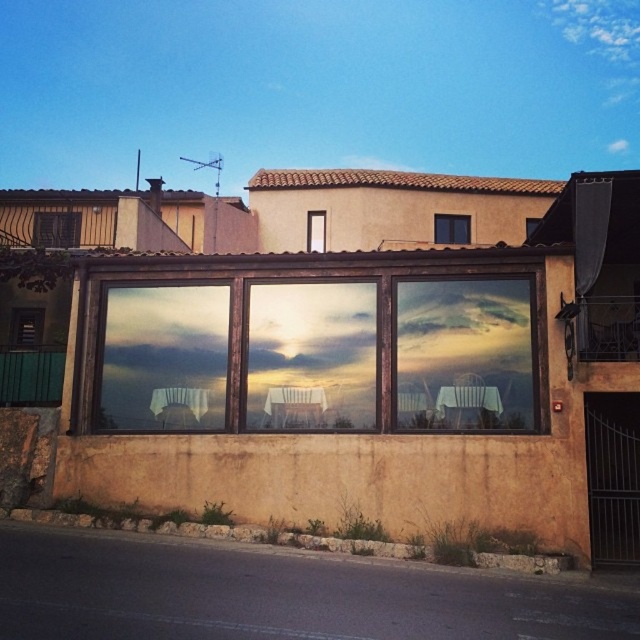
Can you confirm if matte black vent at upper left is positioned to the left of transparent glass door at center?

Indeed, matte black vent at upper left is positioned on the left side of transparent glass door at center.

Locate an element on the screen. matte black vent at upper left is located at coordinates (56, 228).

Is black glass window at upper center bigger than transparent glass door at center?

Correct, black glass window at upper center is larger in size than transparent glass door at center.

This screenshot has width=640, height=640. Identify the location of black glass window at upper center. (451, 228).

The width and height of the screenshot is (640, 640). What are the coordinates of `black glass window at upper center` in the screenshot? It's located at (451, 228).

In the scene shown: Does matte glass window at lower left have a lesser width compared to transparent glass door at center?

No.

The width and height of the screenshot is (640, 640). In order to click on matte glass window at lower left in this screenshot , I will do `click(26, 326)`.

Is point (28, 332) less distant than point (321, 240)?

Yes, it is.

I want to click on matte glass window at lower left, so coord(26,326).